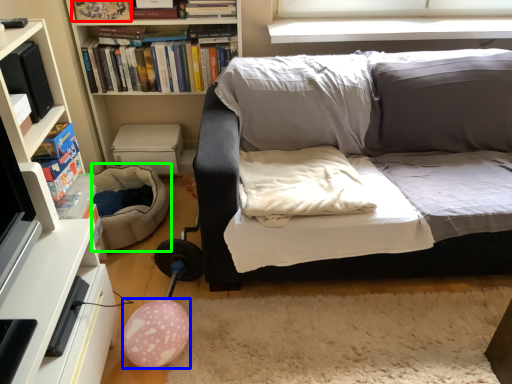
Question: Which object is the farthest from book (highlighted by a red box)? Choose among these: balloon (highlighted by a blue box) or bean bag chair (highlighted by a green box).

Choices:
 (A) balloon
 (B) bean bag chair

Answer: (A)